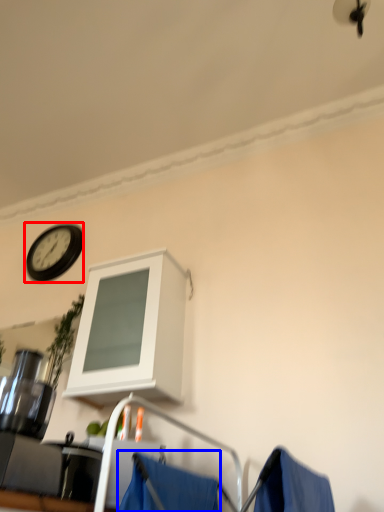
Question: Which of the following is the closest to the observer, wall clock (highlighted by a red box) or curtain (highlighted by a blue box)?

Choices:
 (A) wall clock
 (B) curtain

Answer: (B)